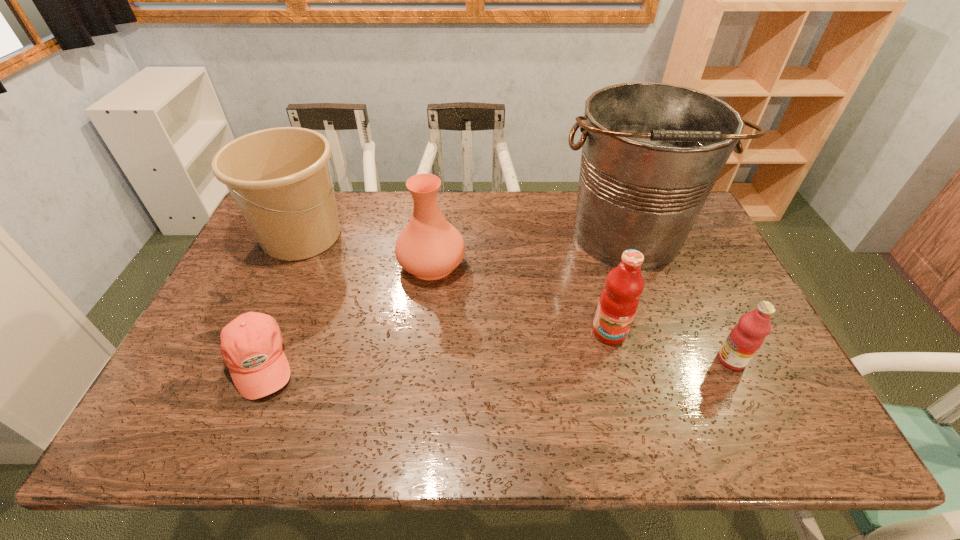
Find the location of `the taller bucket`. the taller bucket is located at coordinates (651, 152).

The image size is (960, 540). I want to click on the tallest object, so click(651, 152).

You are a GUI agent. You are given a task and a screenshot of the screen. Output one action in this format:
    pyautogui.click(x=<x>, y=<y>)
    Task: Click on the left bucket
    
    Given the screenshot: What is the action you would take?
    pyautogui.click(x=280, y=178)

You are a GUI agent. You are given a task and a screenshot of the screen. Output one action in this format:
    pyautogui.click(x=<x>, y=<y>)
    Task: Click on the fourth object from right to left
    The height and width of the screenshot is (540, 960).
    Given the screenshot: What is the action you would take?
    pyautogui.click(x=429, y=247)

Find the location of a particular element. The image size is (960, 540). the farther fruit juice is located at coordinates (619, 300).

Image resolution: width=960 pixels, height=540 pixels. I want to click on the taller fruit juice, so click(619, 300).

The width and height of the screenshot is (960, 540). I want to click on the right fruit juice, so click(x=744, y=340).

Image resolution: width=960 pixels, height=540 pixels. I want to click on the shorter fruit juice, so click(x=744, y=340).

Identify the location of baseball cap. tap(251, 345).

Locate an element on the screen. blank area located on the left of the right bucket is located at coordinates (531, 235).